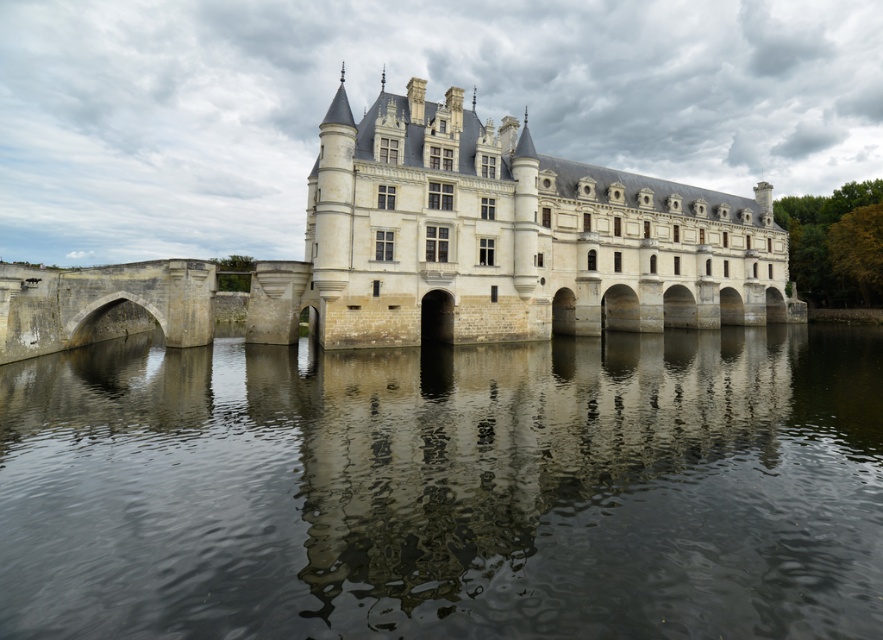
What do you see at coordinates (447, 488) in the screenshot?
I see `dark reflective water at center` at bounding box center [447, 488].

Can you confirm if dark reflective water at center is taller than stone castle at center?

No, dark reflective water at center is not taller than stone castle at center.

This screenshot has width=883, height=640. Find the location of `dark reflective water at center`. dark reflective water at center is located at coordinates (447, 488).